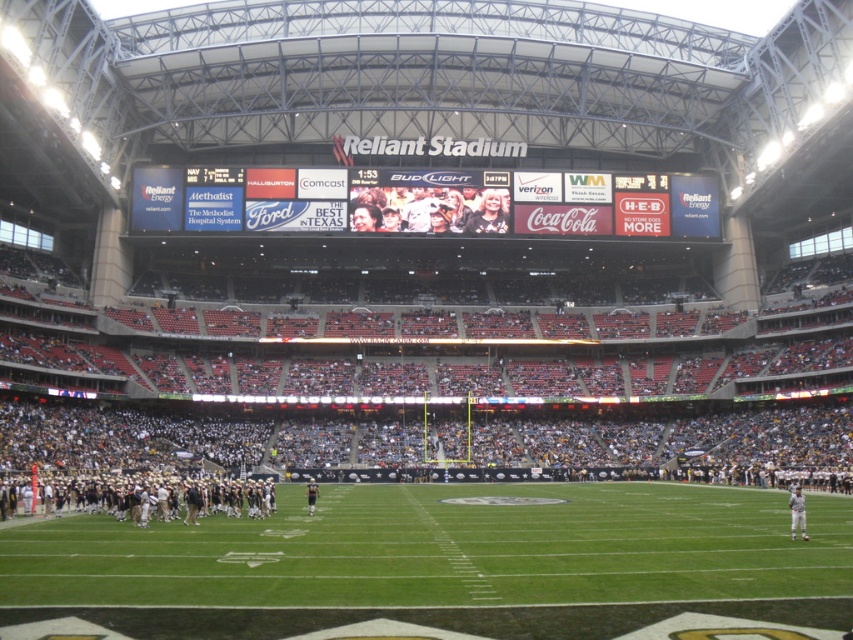
Question: Can you confirm if white digital scoreboard at center is positioned to the right of dark gray uniformed players at lower left?

Choices:
 (A) no
 (B) yes

Answer: (B)

Question: Is white digital scoreboard at center to the left of dark gray uniformed players at lower left from the viewer's perspective?

Choices:
 (A) yes
 (B) no

Answer: (B)

Question: Is white digital scoreboard at center closer to the viewer compared to dark gray uniformed players at lower left?

Choices:
 (A) yes
 (B) no

Answer: (B)

Question: Which object appears farthest from the camera in this image?

Choices:
 (A) white digital scoreboard at center
 (B) dark gray uniformed players at lower left

Answer: (A)